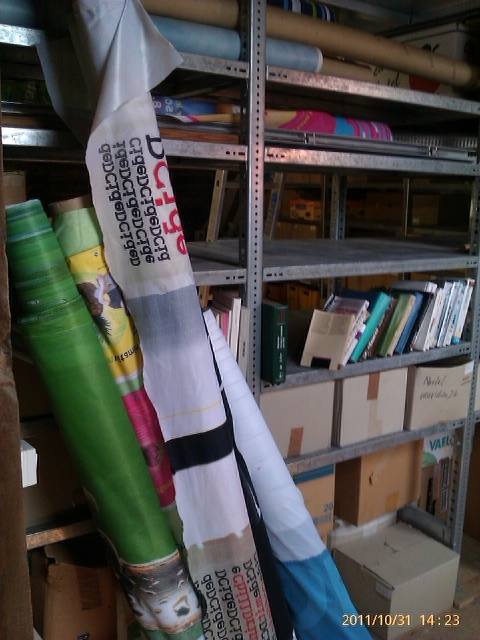
Consider the image. Can you confirm if cardboard box at center is positioned below brown cardboard box at center?

Correct, cardboard box at center is located below brown cardboard box at center.

Who is higher up, cardboard box at center or brown cardboard box at center?

Positioned higher is brown cardboard box at center.

What do you see at coordinates (396, 577) in the screenshot? I see `cardboard box at center` at bounding box center [396, 577].

Image resolution: width=480 pixels, height=640 pixels. Find the location of `cardboard box at center`. cardboard box at center is located at coordinates (396, 577).